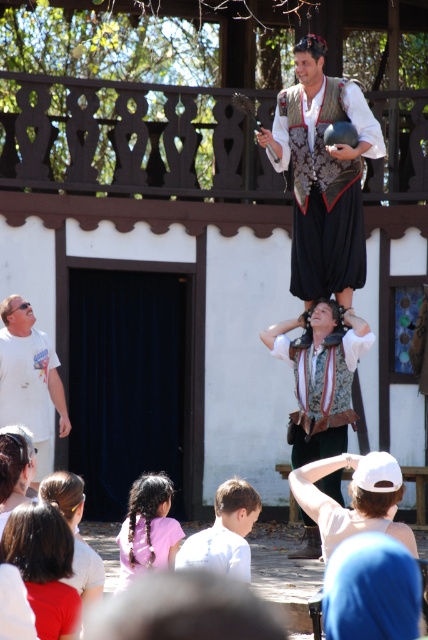
Question: Observing the image, what is the correct spatial positioning of matte black vest at center in reference to white cotton cap at lower right?

Choices:
 (A) above
 (B) below

Answer: (A)

Question: Which point is farther to the camera?

Choices:
 (A) white t-shirt at left
 (B) matte brown vest at center
 (C) pink fabric hair at lower left
 (D) white cotton cap at lower right

Answer: (A)

Question: Which of the following is the closest to the observer?

Choices:
 (A) white cotton cap at lower right
 (B) matte brown vest at center
 (C) blue fabric at lower right

Answer: (C)

Question: Is dark brown hair at lower left to the left of pink fabric hair at lower left from the viewer's perspective?

Choices:
 (A) no
 (B) yes

Answer: (B)

Question: Does matte brown vest at center appear under white cotton cap at lower right?

Choices:
 (A) no
 (B) yes

Answer: (A)

Question: Among these points, which one is nearest to the camera?

Choices:
 (A) (356, 472)
 (B) (350, 360)

Answer: (A)